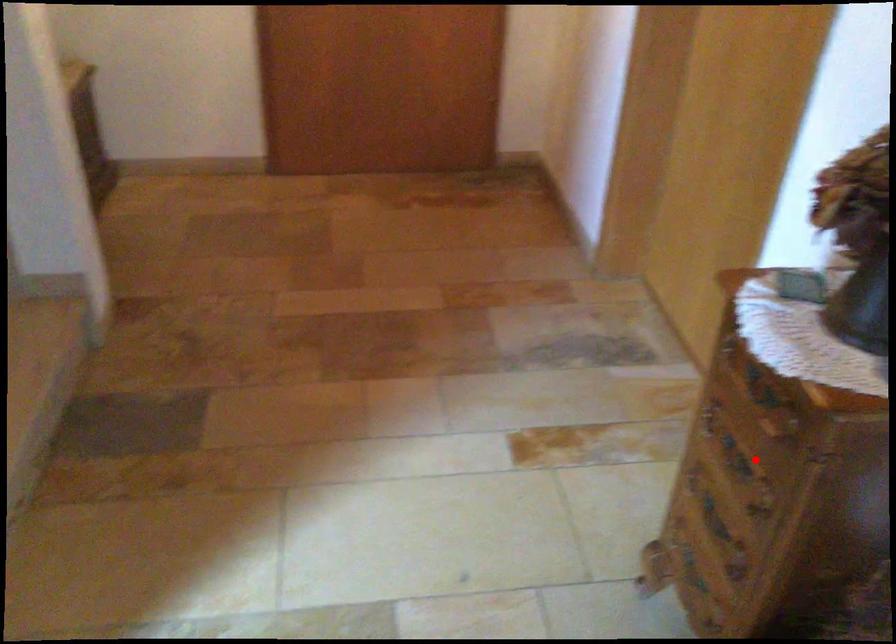
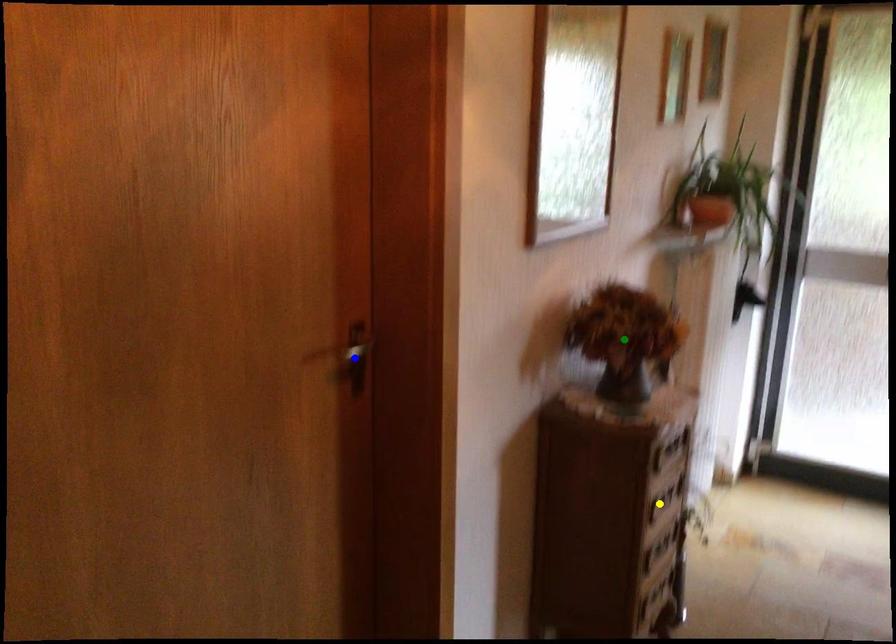
Question: I am providing you with two images of the same scene from different viewpoints. A red point is marked on the first image. You are given multiple points on the second image. Which point in image 2 represents the same 3d spot as the red point in image 1?

Choices:
 (A) blue point
 (B) yellow point
 (C) green point

Answer: (B)